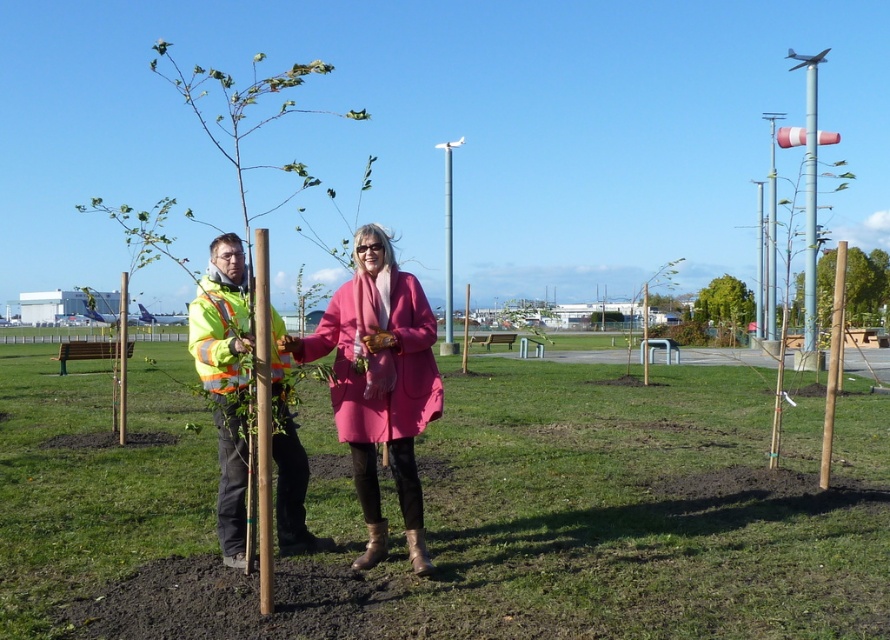
You are a landscape architect designing a park. You need to place a new bench between the metallic pole at center and the green matte tree at center. The bench requires 10 feet of space to fit. Can the bench be placed between them?

The distance between the metallic pole at center and the green matte tree at center is 28.38 feet, which is more than enough to accommodate the bench requiring 10 feet of space.

You are standing at the point labeled as point [448,240] in the image. Looking around, you see a metallic pole at center. Which direction should you face to see the metallic pole at center?

Since the point labeled as point [448,240] is exactly where the metallic pole at center is located, you are already facing the metallic pole at center. There is no need to change your direction.

You are a photographer trying to capture a photo of the matte yellow jacket at center and the brushed metal pole at center. Since you want both objects to appear equally sized in the photo, which object should you move closer to, and why?

You should move closer to the matte yellow jacket at center because it has a lesser width compared to the brushed metal pole at center. By moving closer to the smaller object, you can make it appear larger in the photo, balancing its size with the wider pole.